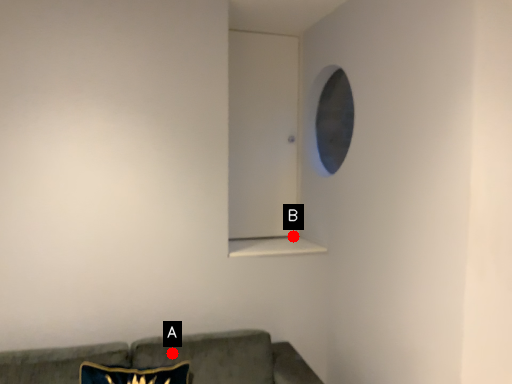
Question: Two points are circled on the image, labeled by A and B beside each circle. Which point is closer to the camera taking this photo?

Choices:
 (A) A is closer
 (B) B is closer

Answer: (A)